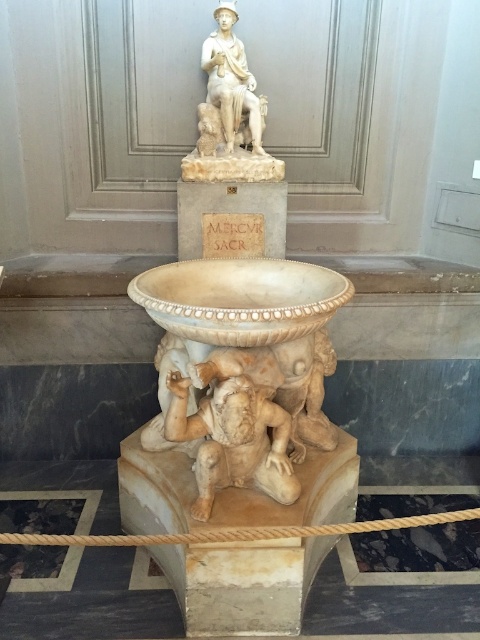
Which is behind, point (240, 403) or point (212, 99)?

The point (212, 99) is behind.

Does marble statue at center have a greater width compared to white marble statue at upper center?

Yes.

Does point (276, 429) come closer to viewer compared to point (225, 8)?

Yes, it is.

Identify the location of marble statue at center. (232, 440).